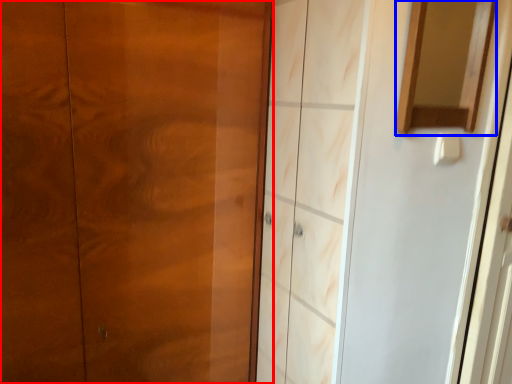
Question: Among these objects, which one is farthest to the camera, door (highlighted by a red box) or mirror (highlighted by a blue box)?

Choices:
 (A) door
 (B) mirror

Answer: (B)